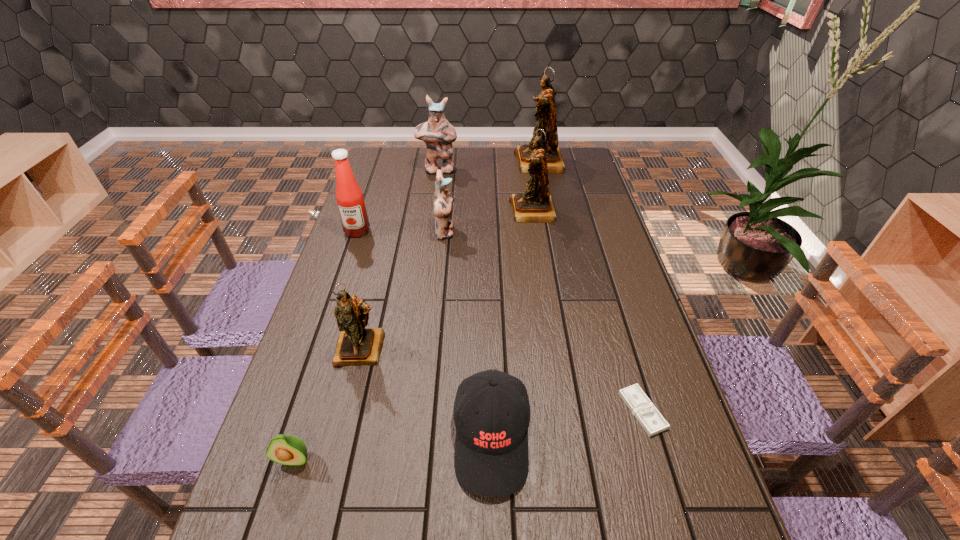
You are a GUI agent. You are given a task and a screenshot of the screen. Output one action in this format:
    pyautogui.click(x=<x>, y=<y>)
    Task: Click on the farthest gold figurine
    This screenshot has width=960, height=540.
    Given the screenshot: What is the action you would take?
    pyautogui.click(x=546, y=117)

Image resolution: width=960 pixels, height=540 pixels. Find the location of `the tallest object`. the tallest object is located at coordinates (546, 117).

The width and height of the screenshot is (960, 540). Find the location of `the second smallest gold figurine`. the second smallest gold figurine is located at coordinates (535, 205).

Where is `the bigger pink figurine`? This screenshot has height=540, width=960. the bigger pink figurine is located at coordinates (438, 134).

You are a GUI agent. You are given a task and a screenshot of the screen. Output one action in this format:
    pyautogui.click(x=<x>, y=<y>)
    Task: Click on the condiment
    The height and width of the screenshot is (540, 960).
    Given the screenshot: What is the action you would take?
    pyautogui.click(x=349, y=197)

The width and height of the screenshot is (960, 540). Identify the location of the smaller pink figurine. (443, 201).

I want to click on the sixth farthest object, so click(x=356, y=345).

The height and width of the screenshot is (540, 960). Find the location of `the leftmost gold figurine`. the leftmost gold figurine is located at coordinates (356, 345).

Locate an element on the screen. The image size is (960, 540). baseball cap is located at coordinates tap(491, 449).

Where is `green avocado`? The height and width of the screenshot is (540, 960). green avocado is located at coordinates [290, 450].